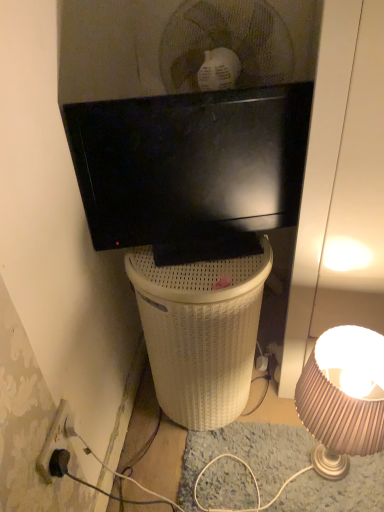
The height and width of the screenshot is (512, 384). I want to click on black plastic power outlet at lower left, so [x=56, y=438].

What do you see at coordinates (191, 169) in the screenshot? This screenshot has width=384, height=512. I see `matte black tv at upper center` at bounding box center [191, 169].

Identify the location of matte black tv at upper center. The image size is (384, 512). (191, 169).

At what (x,y) coordinates should I click in order to perform the action: click on black plastic power outlet at lower left. Please return your answer as a coordinate pair (x, y). This screenshot has height=512, width=384. Looking at the image, I should click on (56, 438).

Is white wicker trash bin/can at center to the left of matte black tv at upper center from the viewer's perspective?

Yes, white wicker trash bin/can at center is to the left of matte black tv at upper center.

From a real-world perspective, who is located lower, white wicker trash bin/can at center or matte black tv at upper center?

white wicker trash bin/can at center is physically lower.

Which is less distant, (x=187, y=355) or (x=225, y=220)?

Point (x=187, y=355) appears to be farther away from the viewer than point (x=225, y=220).

This screenshot has width=384, height=512. What are the coordinates of `power outlet above the white wicker trash bin/can at center (from a real-world perspective)` in the screenshot? It's located at (56, 438).

Could you measure the distance between white wicker trash bin/can at center and black plastic power outlet at lower left?

A distance of 16.00 inches exists between white wicker trash bin/can at center and black plastic power outlet at lower left.

In the scene shown: Does white wicker trash bin/can at center come in front of black plastic power outlet at lower left?

No, white wicker trash bin/can at center is further to the viewer.

The width and height of the screenshot is (384, 512). I want to click on lamp that appears below the white wicker trash bin/can at center (from the image's perspective), so click(343, 398).

Is white wicker trash bin/can at center wider or thinner than matte beige lampshade at lower right?

In the image, white wicker trash bin/can at center appears to be wider than matte beige lampshade at lower right.

Would you say white wicker trash bin/can at center is to the left or to the right of matte beige lampshade at lower right in the picture?

In the image, white wicker trash bin/can at center appears on the left side of matte beige lampshade at lower right.

From the image's perspective, is black plastic power outlet at lower left above or below matte black tv at upper center?

black plastic power outlet at lower left is below matte black tv at upper center.

From their relative heights in the image, would you say black plastic power outlet at lower left is taller or shorter than matte black tv at upper center?

Clearly, black plastic power outlet at lower left is shorter compared to matte black tv at upper center.

Considering the sizes of objects black plastic power outlet at lower left and matte black tv at upper center in the image provided, who is bigger, black plastic power outlet at lower left or matte black tv at upper center?

With larger size is matte black tv at upper center.

How different are the orientations of black plastic power outlet at lower left and matte black tv at upper center in degrees?

73.5 degrees separate the facing orientations of black plastic power outlet at lower left and matte black tv at upper center.

Between point (373, 359) and point (67, 420), which one is positioned in front?

The point (67, 420) is in front.

Find the location of a particular element. lamp on the right of black plastic power outlet at lower left is located at coordinates (343, 398).

In the image, is matte beige lampshade at lower right on the left side or the right side of black plastic power outlet at lower left?

From the image, it's evident that matte beige lampshade at lower right is to the right of black plastic power outlet at lower left.

Is matte beige lampshade at lower right far away from black plastic power outlet at lower left?

matte beige lampshade at lower right is actually quite close to black plastic power outlet at lower left.

Between point (121, 247) and point (58, 423), which one is positioned behind?

Point (121, 247)

From a real-world perspective, between matte black tv at upper center and black plastic power outlet at lower left, who is vertically higher?

matte black tv at upper center is physically above.

Who is shorter, matte black tv at upper center or black plastic power outlet at lower left?

black plastic power outlet at lower left.

Is matte black tv at upper center far from black plastic power outlet at lower left?

No, matte black tv at upper center is in close proximity to black plastic power outlet at lower left.

Does black plastic power outlet at lower left have a lesser width compared to matte beige lampshade at lower right?

Yes.

Is black plastic power outlet at lower left bigger or smaller than matte beige lampshade at lower right?

Considering their sizes, black plastic power outlet at lower left takes up less space than matte beige lampshade at lower right.

Which is in front, point (59, 413) or point (309, 382)?

The point (59, 413) is in front.

The image size is (384, 512). In order to click on lamp below the black plastic power outlet at lower left (from a real-world perspective) in this screenshot , I will do `click(343, 398)`.

Where is `television in front of the white wicker trash bin/can at center`? television in front of the white wicker trash bin/can at center is located at coordinates (191, 169).

Identify the location of trash bin/can above the black plastic power outlet at lower left (from the image's perspective). This screenshot has width=384, height=512. (200, 332).

From the picture: When comparing their distances from matte black tv at upper center, does white wicker trash bin/can at center or black plastic power outlet at lower left seem closer?

The object closer to matte black tv at upper center is white wicker trash bin/can at center.

Estimate the real-world distances between objects in this image. Which object is further from matte beige lampshade at lower right, black plastic power outlet at lower left or matte black tv at upper center?

black plastic power outlet at lower left lies further to matte beige lampshade at lower right than the other object.

Which object lies nearer to the anchor point white wicker trash bin/can at center, black plastic power outlet at lower left or matte black tv at upper center?

matte black tv at upper center.

Consider the image. Considering their positions, is matte beige lampshade at lower right positioned closer to black plastic power outlet at lower left than white wicker trash bin/can at center?

white wicker trash bin/can at center is closer to black plastic power outlet at lower left.

Which object lies further to the anchor point matte beige lampshade at lower right, black plastic power outlet at lower left or white wicker trash bin/can at center?

Among the two, black plastic power outlet at lower left is located further to matte beige lampshade at lower right.

Looking at this image, from the image, which object appears to be farther from black plastic power outlet at lower left, matte black tv at upper center or white wicker trash bin/can at center?

matte black tv at upper center is further to black plastic power outlet at lower left.

When comparing their distances from matte black tv at upper center, does matte beige lampshade at lower right or white wicker trash bin/can at center seem further?

The object further to matte black tv at upper center is matte beige lampshade at lower right.

Considering their positions, is black plastic power outlet at lower left positioned further to matte black tv at upper center than white wicker trash bin/can at center?

The object further to matte black tv at upper center is black plastic power outlet at lower left.

What are the coordinates of `trash bin/can between matte black tv at upper center and matte beige lampshade at lower right in the vertical direction` in the screenshot? It's located at (200, 332).

Image resolution: width=384 pixels, height=512 pixels. I want to click on trash bin/can between black plastic power outlet at lower left and matte beige lampshade at lower right, so click(x=200, y=332).

Identify the location of power outlet between matte black tv at upper center and matte beige lampshade at lower right vertically. 56,438.

Image resolution: width=384 pixels, height=512 pixels. Find the location of `trash bin/can that lies between matte black tv at upper center and black plastic power outlet at lower left from top to bottom`. trash bin/can that lies between matte black tv at upper center and black plastic power outlet at lower left from top to bottom is located at coordinates (200, 332).